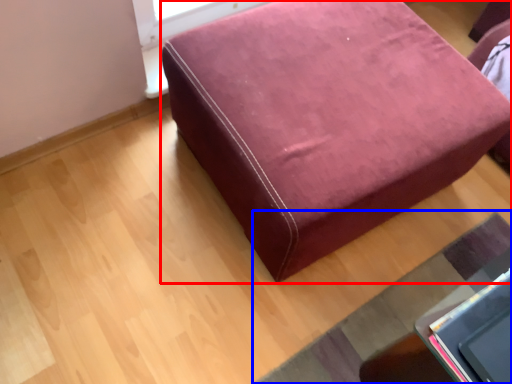
Question: Which of the following is the closest to the observer, furniture (highlighted by a red box) or mat (highlighted by a blue box)?

Choices:
 (A) furniture
 (B) mat

Answer: (A)